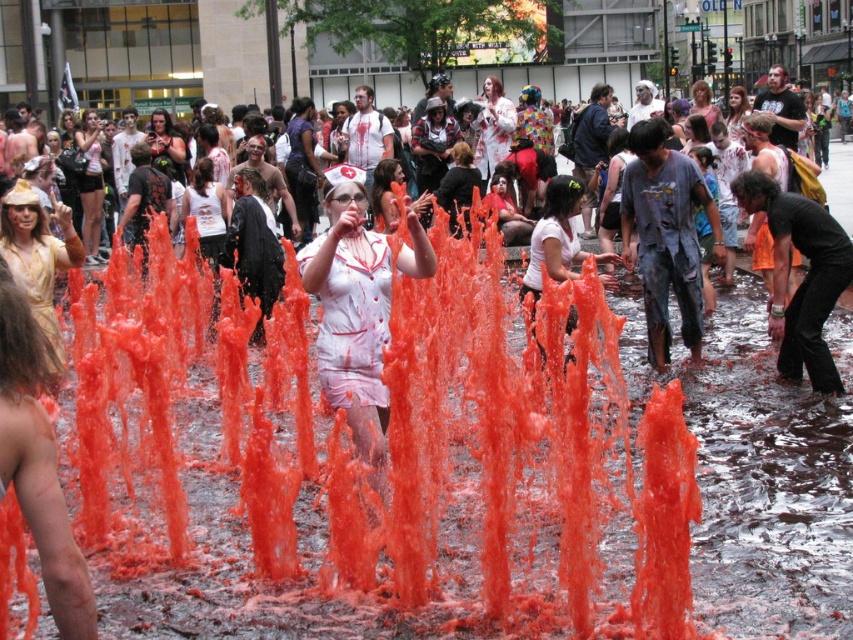
Between white matte nurse hat at center and matte white nurse hat at center, which one is positioned lower?

Positioned lower is white matte nurse hat at center.

How far apart are white matte nurse hat at center and matte white nurse hat at center?

A distance of 8.34 meters exists between white matte nurse hat at center and matte white nurse hat at center.

Which is behind, point (558, 180) or point (729, 93)?

Positioned behind is point (729, 93).

I want to click on white matte nurse hat at center, so click(x=554, y=236).

Locate an element on the screen. Image resolution: width=853 pixels, height=640 pixels. gold textured dress at left is located at coordinates (38, 253).

Measure the distance between point (26, 236) and camera.

Point (26, 236) is 10.64 meters away from camera.

This screenshot has height=640, width=853. What are the coordinates of `gold textured dress at left` in the screenshot? It's located at (38, 253).

Is point (54, 262) positioned after point (90, 234)?

That is False.

Does gold textured dress at left appear on the right side of matte white nurse hat at upper left?

Indeed, gold textured dress at left is positioned on the right side of matte white nurse hat at upper left.

Is point (67, 256) less distant than point (91, 246)?

Yes, point (67, 256) is in front of point (91, 246).

Identify the location of gold textured dress at left. (38, 253).